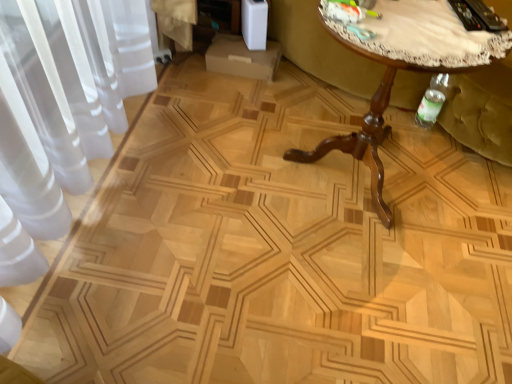
Find the location of a particular element. The width and height of the screenshot is (512, 384). free area below brown wooden table at center (from a real-world perspective) is located at coordinates (364, 177).